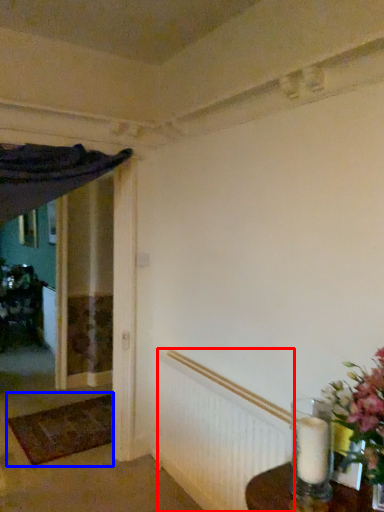
Question: Which point is closer to the camera, radiator (highlighted by a red box) or doormat (highlighted by a blue box)?

Choices:
 (A) radiator
 (B) doormat

Answer: (A)